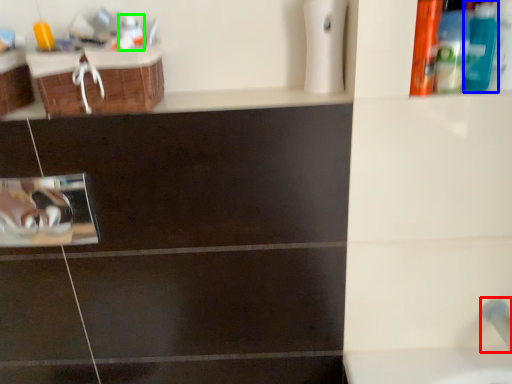
Question: Estimate the real-world distances between objects in this image. Which object is closer to plumbing fixture (highlighted by a red box), mouthwash (highlighted by a blue box) or mouthwash (highlighted by a green box)?

Choices:
 (A) mouthwash
 (B) mouthwash

Answer: (A)